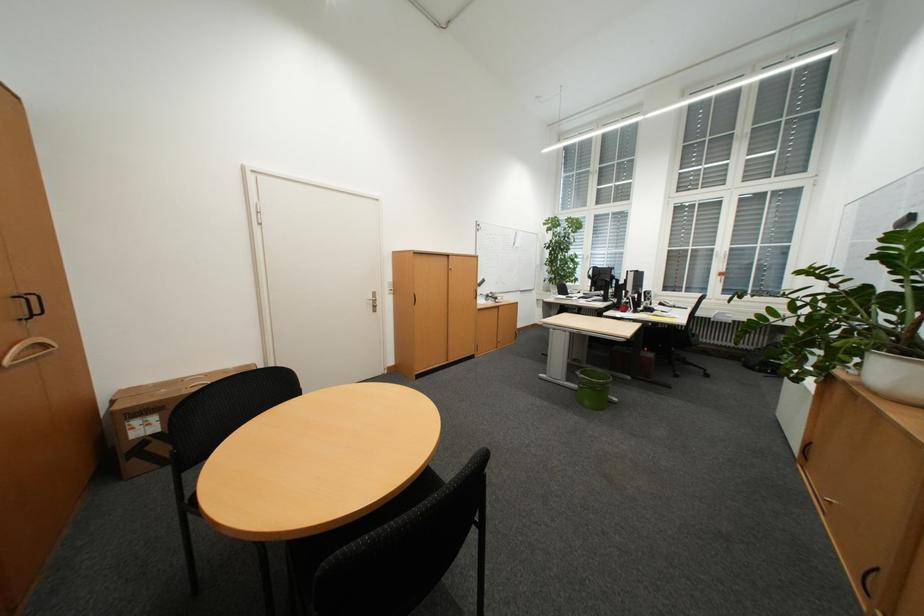
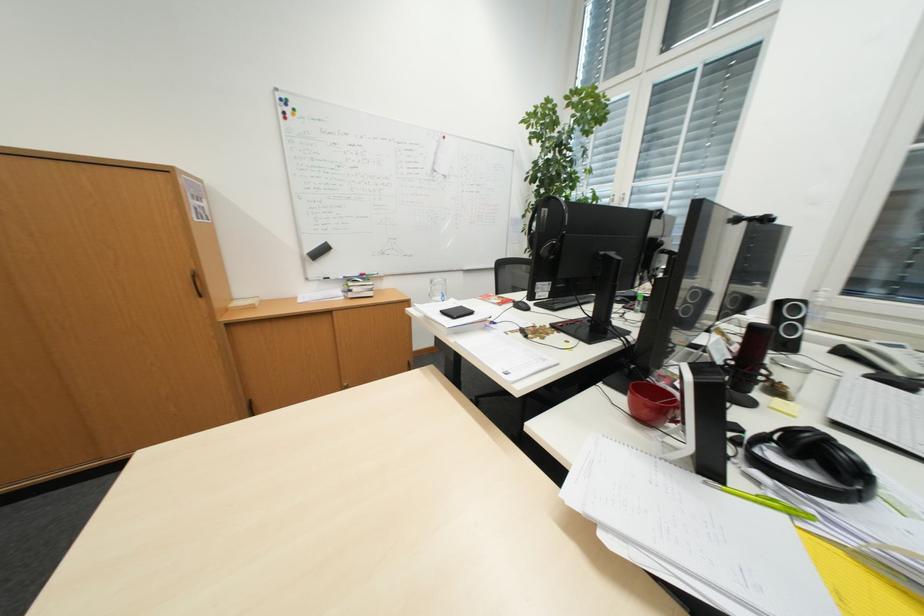
What movement of the cameraman would produce the second image?

The movement direction of the cameraman is right, forward.